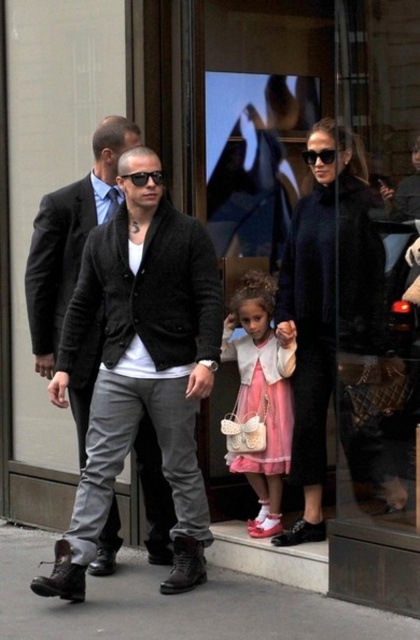
Does dark gray knit cardigan at center have a greater height compared to pink satin dress at center?

Yes.

Image resolution: width=420 pixels, height=640 pixels. What are the coordinates of `dark gray knit cardigan at center` in the screenshot? It's located at (141, 369).

Does dark gray knit cardigan at center have a greater height compared to black plastic sunglasses at upper center?

Yes.

Is dark gray knit cardigan at center shorter than black plastic sunglasses at upper center?

No.

Looking at this image, who is more distant from viewer, [184,253] or [309,152]?

Point [309,152]

Locate an element on the screen. The width and height of the screenshot is (420, 640). dark gray knit cardigan at center is located at coordinates (141, 369).

Which is more to the right, pink satin dress at center or black plastic sunglasses at center?

pink satin dress at center

Is point (265, 337) farther from camera compared to point (142, 182)?

Yes, it is behind point (142, 182).

Does point (262, 449) lie behind point (136, 186)?

Yes, point (262, 449) is farther from viewer.

Where is `pink satin dress at center`? pink satin dress at center is located at coordinates (260, 396).